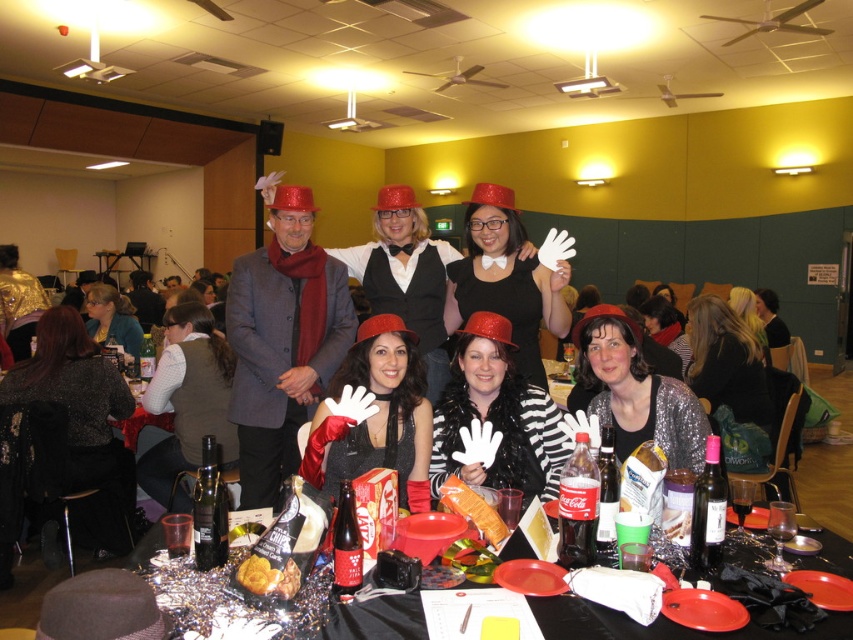
Does white matte gloves at center have a larger size compared to velvet brown vest at lower left?

No.

Can you confirm if white matte gloves at center is thinner than velvet brown vest at lower left?

Yes.

At what (x,y) coordinates should I click in order to perform the action: click on white matte gloves at center. Please return your answer as a coordinate pair (x, y). Looking at the image, I should click on click(526, 440).

Is matte black dress at center to the right of shiny red hat at center from the viewer's perspective?

Incorrect, matte black dress at center is not on the right side of shiny red hat at center.

Which is behind, point (415, 474) or point (538, 301)?

Point (538, 301)

Locate an element on the screen. This screenshot has height=640, width=853. matte black dress at center is located at coordinates (375, 412).

How much distance is there between velvet brown vest at lower left and golden crispy pastry at center?

velvet brown vest at lower left and golden crispy pastry at center are 7.12 feet apart from each other.

Is velvet brown vest at lower left behind golden crispy pastry at center?

Yes, it is behind golden crispy pastry at center.

Between point (187, 440) and point (274, 589), which one is positioned in front?

Positioned in front is point (274, 589).

Image resolution: width=853 pixels, height=640 pixels. What are the coordinates of `velvet brown vest at lower left` in the screenshot? It's located at (186, 412).